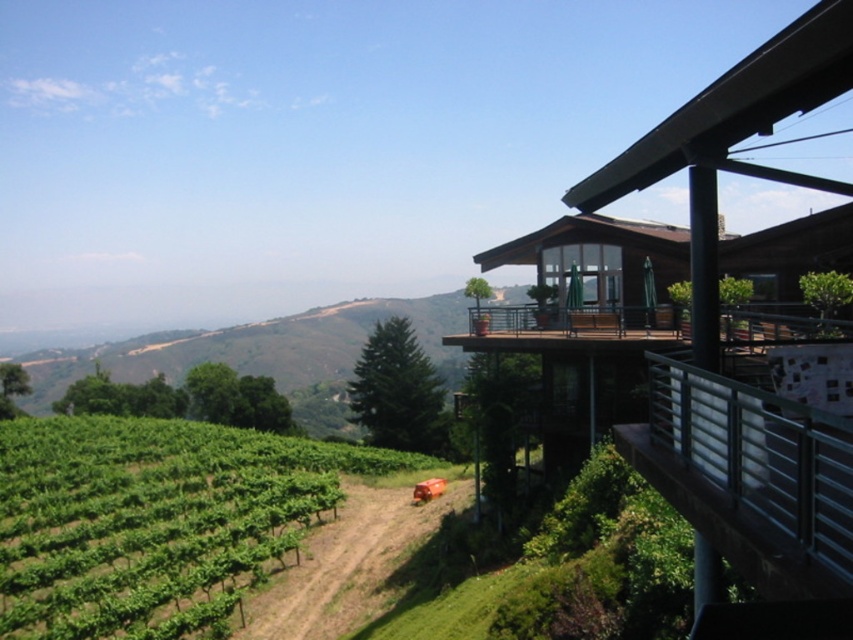
You are standing on the wooden deck at upper right and want to reach the metallic silver railing at upper right. Based on the scene description, which direction should you move to ascend towards the railing?

To ascend towards the metallic silver railing at upper right, you should move forward since the metallic silver railing at upper right has a greater height compared to the wooden deck at upper right.

You are planning a hiking route and see the green leafy vineyard at lower left and the brown dirt track at lower center. Which direction should you head to reach the vineyard from the dirt track?

To reach the green leafy vineyard at lower left from the brown dirt track at lower center, you should head to the left since the vineyard is positioned to the left of the dirt track.